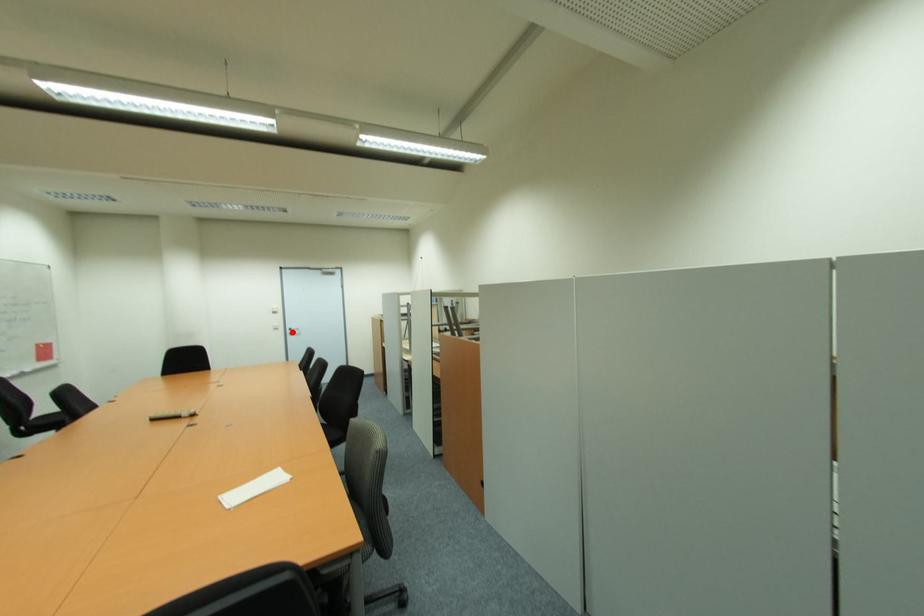
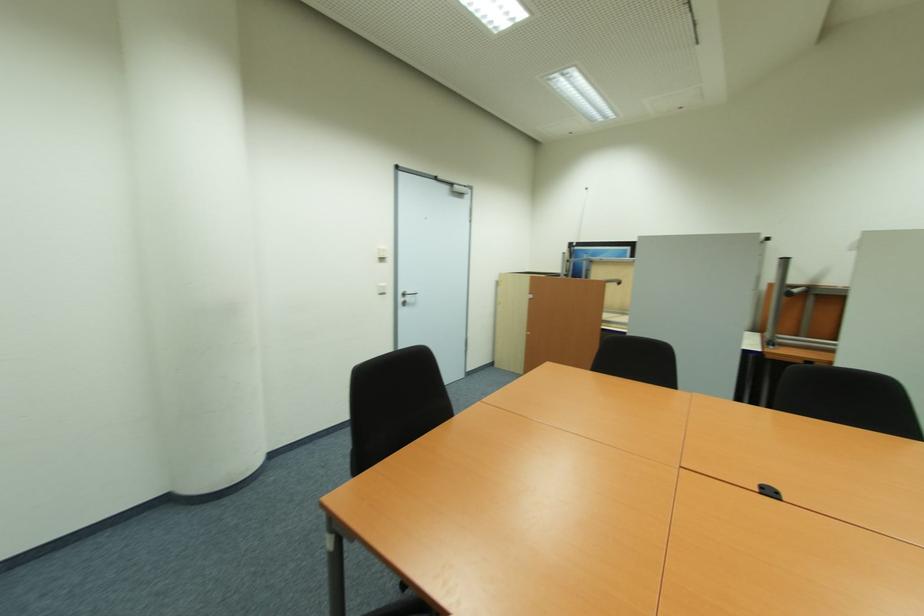
Locate, in the second image, the point that corresponds to the highlighted location in the first image.

(405, 300)